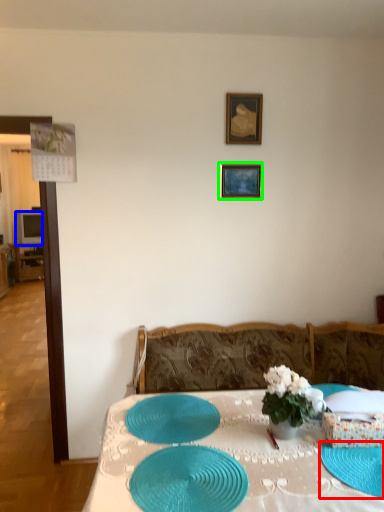
Question: Which is farther away from glass plate (highlighted by a red box)? television (highlighted by a blue box) or picture frame (highlighted by a green box)?

Choices:
 (A) television
 (B) picture frame

Answer: (A)